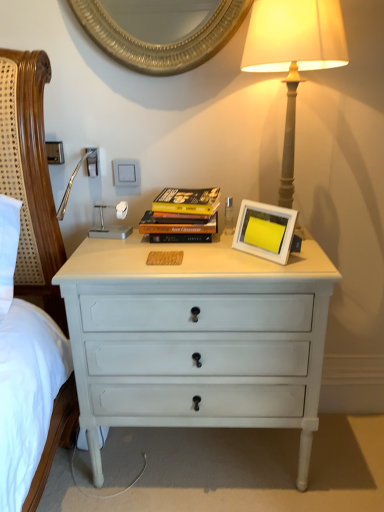
Measure the distance between point (80,272) and camera.

Point (80,272) is 1.13 meters from camera.

Identify the location of hardcover books at center. point(182,214).

Is matte gray lamp at upper right completely or partially inside white painted wood chest of drawers at center?

No, white painted wood chest of drawers at center does not contain matte gray lamp at upper right.

Is matte gray lamp at upper right at the back of white painted wood chest of drawers at center?

No, white painted wood chest of drawers at center is not facing away from matte gray lamp at upper right.

Is white painted wood chest of drawers at center positioned behind matte gray lamp at upper right?

Yes, white painted wood chest of drawers at center is behind matte gray lamp at upper right.

Which of these two, white painted wood chest of drawers at center or matte gray lamp at upper right, stands taller?

white painted wood chest of drawers at center is taller.

Consider the image. Who is taller, hardcover books at center or white matte picture frame at center?

hardcover books at center is taller.

From a real-world perspective, which is physically above, hardcover books at center or white matte picture frame at center?

hardcover books at center, from a real-world perspective.

Would you say white matte picture frame at center is part of hardcover books at center's contents?

No, white matte picture frame at center is not a part of hardcover books at center.

Where is `picture frame located in front of the hardcover books at center`? Image resolution: width=384 pixels, height=512 pixels. picture frame located in front of the hardcover books at center is located at coordinates coord(265,231).

Consider the image. Is the position of matte gray lamp at upper right more distant than that of hardcover books at center?

That is False.

Does matte gray lamp at upper right have a smaller size compared to hardcover books at center?

Incorrect, matte gray lamp at upper right is not smaller in size than hardcover books at center.

Which object is wider, matte gray lamp at upper right or hardcover books at center?

Wider between the two is matte gray lamp at upper right.

Is hardcover books at center inside or outside of white painted wood chest of drawers at center?

hardcover books at center lies outside white painted wood chest of drawers at center.

Is hardcover books at center beside white painted wood chest of drawers at center?

No, hardcover books at center is not beside white painted wood chest of drawers at center.

Based on the photo, from the image's perspective, does hardcover books at center appear lower than white painted wood chest of drawers at center?

No, from the image's perspective, hardcover books at center is not below white painted wood chest of drawers at center.

Does hardcover books at center have a lesser height compared to white painted wood chest of drawers at center?

Correct, hardcover books at center is not as tall as white painted wood chest of drawers at center.

Between hardcover books at center and matte gray lamp at upper right, which one is positioned in front?

matte gray lamp at upper right is closer to the camera.

Between hardcover books at center and matte gray lamp at upper right, which one has larger size?

matte gray lamp at upper right.

The width and height of the screenshot is (384, 512). I want to click on bedside lamp above the hardcover books at center (from a real-world perspective), so point(293,56).

Does hardcover books at center turn towards matte gray lamp at upper right?

No, hardcover books at center does not turn towards matte gray lamp at upper right.

Is white matte picture frame at center not within matte gray lamp at upper right?

No, white matte picture frame at center is inside or overlapping with matte gray lamp at upper right.

Is the surface of white matte picture frame at center in direct contact with matte gray lamp at upper right?

There is a gap between white matte picture frame at center and matte gray lamp at upper right.

Considering the relative sizes of white matte picture frame at center and matte gray lamp at upper right in the image provided, is white matte picture frame at center shorter than matte gray lamp at upper right?

Indeed, white matte picture frame at center has a lesser height compared to matte gray lamp at upper right.

Can you confirm if matte gray lamp at upper right is positioned to the right of white painted wood chest of drawers at center?

Correct, you'll find matte gray lamp at upper right to the right of white painted wood chest of drawers at center.

How different are the orientations of matte gray lamp at upper right and white painted wood chest of drawers at center in degrees?

matte gray lamp at upper right and white painted wood chest of drawers at center are facing 0.694 degrees away from each other.

Would you say matte gray lamp at upper right is inside or outside white painted wood chest of drawers at center?

matte gray lamp at upper right cannot be found inside white painted wood chest of drawers at center.

The width and height of the screenshot is (384, 512). I want to click on chest of drawers that appears on the left of matte gray lamp at upper right, so click(197, 338).

The height and width of the screenshot is (512, 384). I want to click on picture frame in front of the hardcover books at center, so click(x=265, y=231).

Looking at the image, which one is located closer to hardcover books at center, white painted wood chest of drawers at center or matte gray lamp at upper right?

white painted wood chest of drawers at center is closer to hardcover books at center.

Estimate the real-world distances between objects in this image. Which object is closer to matte gray lamp at upper right, hardcover books at center or white matte picture frame at center?

white matte picture frame at center is closer to matte gray lamp at upper right.

In the scene shown: Looking at the image, which one is located further to white painted wood chest of drawers at center, white matte picture frame at center or hardcover books at center?

The object further to white painted wood chest of drawers at center is hardcover books at center.

Based on their spatial positions, is white matte picture frame at center or matte gray lamp at upper right closer to white painted wood chest of drawers at center?

Among the two, white matte picture frame at center is located nearer to white painted wood chest of drawers at center.

Which object lies nearer to the anchor point white matte picture frame at center, matte gray lamp at upper right or white painted wood chest of drawers at center?

Among the two, white painted wood chest of drawers at center is located nearer to white matte picture frame at center.

From the image, which object appears to be nearer to matte gray lamp at upper right, white painted wood chest of drawers at center or hardcover books at center?

hardcover books at center lies closer to matte gray lamp at upper right than the other object.

Based on the photo, estimate the real-world distances between objects in this image. Which object is closer to hardcover books at center, white matte picture frame at center or matte gray lamp at upper right?

white matte picture frame at center is closer to hardcover books at center.

In the scene shown: Looking at the image, which one is located closer to matte gray lamp at upper right, white matte picture frame at center or hardcover books at center?

Among the two, white matte picture frame at center is located nearer to matte gray lamp at upper right.

Locate an element on the screen. picture frame between matte gray lamp at upper right and white painted wood chest of drawers at center from top to bottom is located at coordinates (265, 231).

Where is `picture frame between hardcover books at center and matte gray lamp at upper right`? picture frame between hardcover books at center and matte gray lamp at upper right is located at coordinates (265, 231).

Locate an element on the screen. magazine that lies between matte gray lamp at upper right and white painted wood chest of drawers at center from top to bottom is located at coordinates (182, 214).

This screenshot has width=384, height=512. In order to click on picture frame between hardcover books at center and white painted wood chest of drawers at center from top to bottom in this screenshot , I will do `click(265, 231)`.